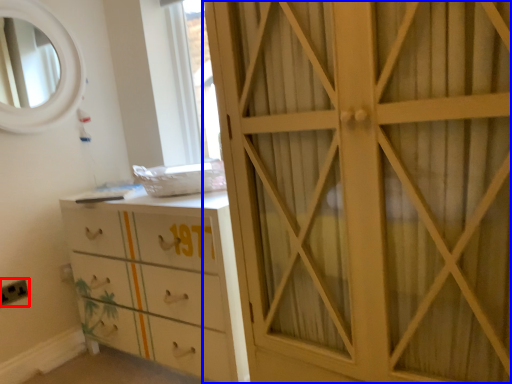
Question: Which point is further to the camera, electric outlet (highlighted by a red box) or cupboard (highlighted by a blue box)?

Choices:
 (A) electric outlet
 (B) cupboard

Answer: (A)